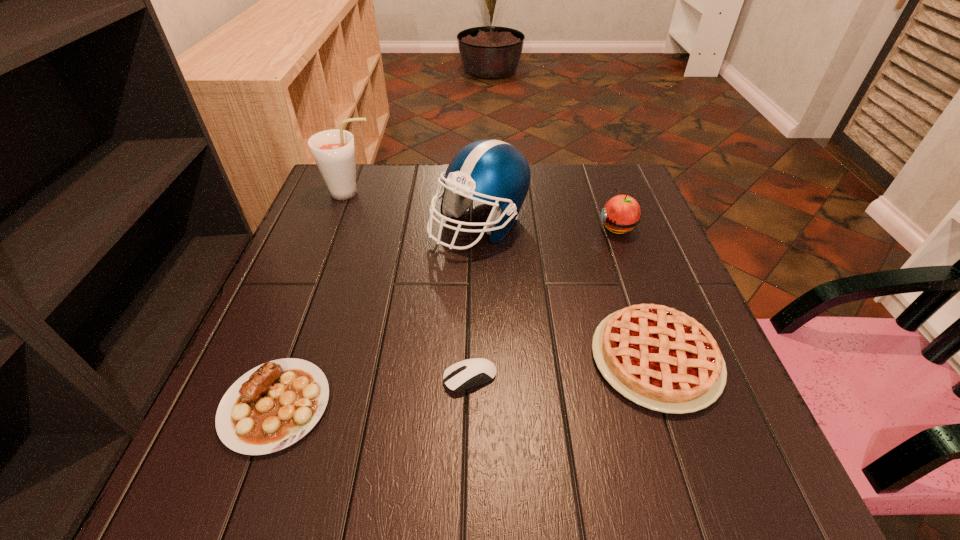
Where is `vacant space that satisfies the following two spatial constraints: 1. on the back side of the third tallest object; 2. on the right side of the steak`? The width and height of the screenshot is (960, 540). vacant space that satisfies the following two spatial constraints: 1. on the back side of the third tallest object; 2. on the right side of the steak is located at coordinates (341, 227).

The image size is (960, 540). Identify the location of blank area in the image that satisfies the following two spatial constraints: 1. at the front of the football helmet with the faceguard; 2. on the left side of the apple. (479, 227).

The width and height of the screenshot is (960, 540). What are the coordinates of `free space that satisfies the following two spatial constraints: 1. on the drink side of the mouse; 2. on the right side of the root beer` in the screenshot? It's located at (280, 378).